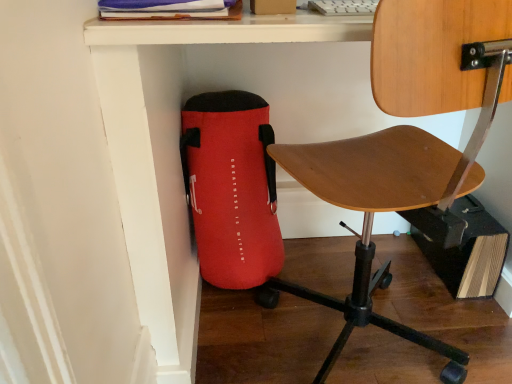
Identify the location of vacant space in wooden seat at center (from a real-world perspective). (367, 336).